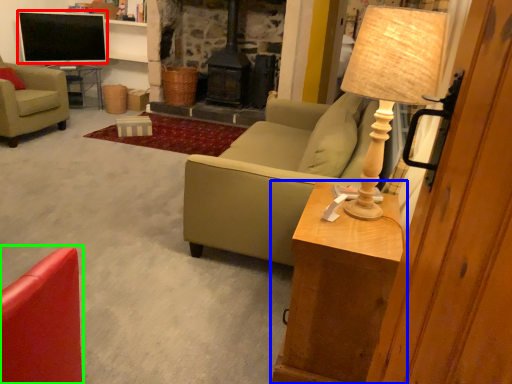
Question: Which is farther away from television (highlighted by a red box)? table (highlighted by a blue box) or chair (highlighted by a green box)?

Choices:
 (A) table
 (B) chair

Answer: (B)